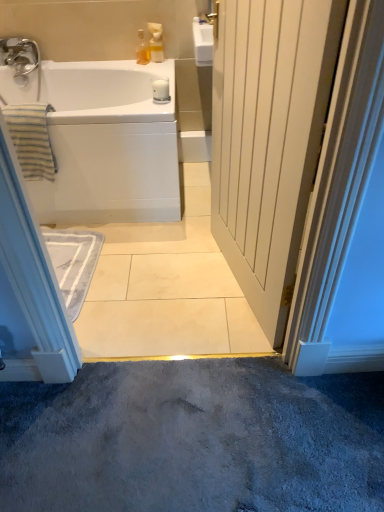
Question: From the image's perspective, is white wood door at center on top of translucent glass bottle at upper center, marked as the second toiletry in a right-to-left arrangement?

Choices:
 (A) yes
 (B) no

Answer: (B)

Question: Does white wood door at center lie in front of translucent glass bottle at upper center, marked as the second toiletry in a right-to-left arrangement?

Choices:
 (A) yes
 (B) no

Answer: (A)

Question: Considering the relative sizes of white wood door at center and translucent glass bottle at upper center, marked as the second toiletry in a right-to-left arrangement, in the image provided, is white wood door at center wider than translucent glass bottle at upper center, marked as the second toiletry in a right-to-left arrangement,?

Choices:
 (A) no
 (B) yes

Answer: (B)

Question: Is white wood door at center at the left side of translucent glass bottle at upper center, marked as the second toiletry in a right-to-left arrangement?

Choices:
 (A) yes
 (B) no

Answer: (B)

Question: Does white wood door at center have a greater height compared to translucent glass bottle at upper center, placed as the first toiletry when sorted from left to right?

Choices:
 (A) yes
 (B) no

Answer: (A)

Question: Is white glossy bathtub at upper left inside the boundaries of translucent glass bottle at upper center, marked as the second toiletry in a right-to-left arrangement, or outside?

Choices:
 (A) outside
 (B) inside

Answer: (A)

Question: From a real-world perspective, is white glossy bathtub at upper left positioned above or below translucent glass bottle at upper center, placed as the first toiletry when sorted from left to right?

Choices:
 (A) above
 (B) below

Answer: (B)

Question: In terms of size, does white glossy bathtub at upper left appear bigger or smaller than translucent glass bottle at upper center, marked as the second toiletry in a right-to-left arrangement?

Choices:
 (A) small
 (B) big

Answer: (B)

Question: In terms of height, does white glossy bathtub at upper left look taller or shorter compared to translucent glass bottle at upper center, placed as the first toiletry when sorted from left to right?

Choices:
 (A) tall
 (B) short

Answer: (A)

Question: Is translucent glass bottle at upper center, marked as the second toiletry in a right-to-left arrangement, taller or shorter than white glossy bathtub at upper left?

Choices:
 (A) tall
 (B) short

Answer: (B)

Question: Considering their positions, is translucent glass bottle at upper center, marked as the second toiletry in a right-to-left arrangement, located in front of or behind white glossy bathtub at upper left?

Choices:
 (A) front
 (B) behind

Answer: (B)

Question: From a real-world perspective, is translucent glass bottle at upper center, marked as the second toiletry in a right-to-left arrangement, positioned above or below white glossy bathtub at upper left?

Choices:
 (A) above
 (B) below

Answer: (A)

Question: Do you think translucent glass bottle at upper center, placed as the first toiletry when sorted from left to right, is within white glossy bathtub at upper left, or outside of it?

Choices:
 (A) inside
 (B) outside

Answer: (B)

Question: Is white glossy bathtub at upper left situated inside striped cotton towel at left or outside?

Choices:
 (A) outside
 (B) inside

Answer: (A)

Question: In terms of size, does white glossy bathtub at upper left appear bigger or smaller than striped cotton towel at left?

Choices:
 (A) small
 (B) big

Answer: (B)